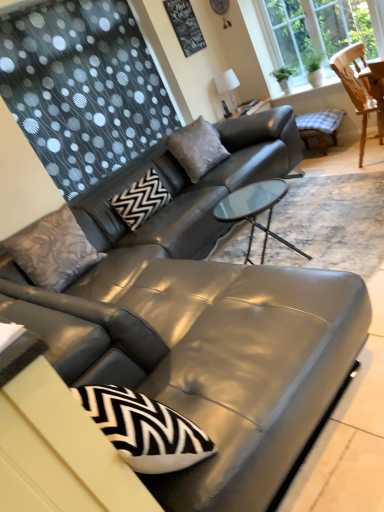
Question: Can you confirm if textured gray pillow at left, the 1th pillow from the left, is bigger than transparent glass window at upper right?

Choices:
 (A) yes
 (B) no

Answer: (B)

Question: Is textured gray pillow at left, the 1th pillow from the left, wider than transparent glass window at upper right?

Choices:
 (A) yes
 (B) no

Answer: (A)

Question: Is textured gray pillow at left, which is the 3th pillow from right to left, outside of transparent glass window at upper right?

Choices:
 (A) no
 (B) yes

Answer: (B)

Question: From the image's perspective, is textured gray pillow at left, which is the 3th pillow from right to left, located above transparent glass window at upper right?

Choices:
 (A) no
 (B) yes

Answer: (A)

Question: Does textured gray pillow at left, the 1th pillow from the left, lie behind transparent glass window at upper right?

Choices:
 (A) yes
 (B) no

Answer: (B)

Question: Is matte gray cushion at center, acting as the first pillow starting from the right, in front of or behind wooden chair at upper right in the image?

Choices:
 (A) front
 (B) behind

Answer: (B)

Question: From their relative heights in the image, would you say matte gray cushion at center, which is the third pillow in left-to-right order, is taller or shorter than wooden chair at upper right?

Choices:
 (A) tall
 (B) short

Answer: (B)

Question: Based on their sizes in the image, would you say matte gray cushion at center, acting as the first pillow starting from the right, is bigger or smaller than wooden chair at upper right?

Choices:
 (A) small
 (B) big

Answer: (A)

Question: From a real-world perspective, is matte gray cushion at center, which is the third pillow in left-to-right order, above or below wooden chair at upper right?

Choices:
 (A) above
 (B) below

Answer: (A)

Question: Is black textured board at upper center inside or outside of matte gray cushion at center, acting as the first pillow starting from the right?

Choices:
 (A) inside
 (B) outside

Answer: (B)

Question: Considering their positions, is black textured board at upper center located in front of or behind matte gray cushion at center, which is the third pillow in left-to-right order?

Choices:
 (A) front
 (B) behind

Answer: (B)

Question: Based on their sizes in the image, would you say black textured board at upper center is bigger or smaller than matte gray cushion at center, acting as the first pillow starting from the right?

Choices:
 (A) small
 (B) big

Answer: (A)

Question: From a real-world perspective, is black textured board at upper center physically located above or below matte gray cushion at center, which is the third pillow in left-to-right order?

Choices:
 (A) above
 (B) below

Answer: (A)

Question: Considering the positions of point (157, 177) and point (187, 29), is point (157, 177) closer or farther from the camera than point (187, 29)?

Choices:
 (A) closer
 (B) farther

Answer: (A)

Question: Is black zigzag-patterned pillow at center, which appears as the 2th pillow when viewed from the right, in front of or behind black textured board at upper center in the image?

Choices:
 (A) front
 (B) behind

Answer: (A)